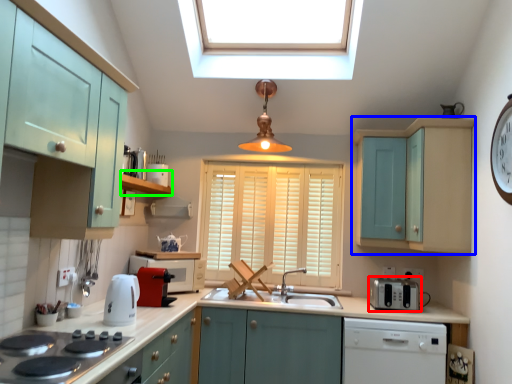
Question: Based on their relative distances, which object is farther from appliance (highlighted by a red box)? Choose from cabinetry (highlighted by a blue box) and shelf (highlighted by a green box).

Choices:
 (A) cabinetry
 (B) shelf

Answer: (B)